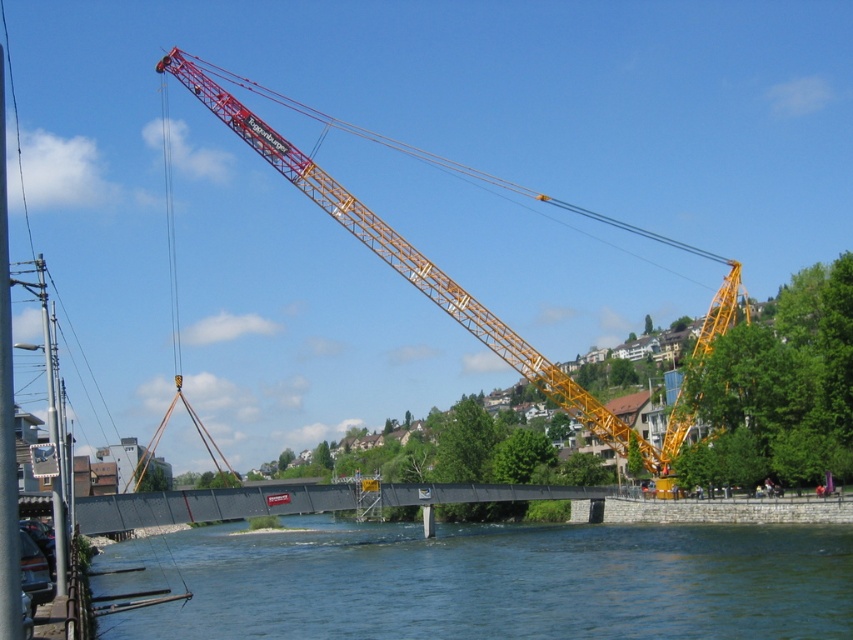
Question: Does clear blue water at lower center have a greater width compared to red/yellow metal crane at upper center?

Choices:
 (A) no
 (B) yes

Answer: (A)

Question: Can you confirm if clear blue water at lower center is positioned above red/yellow metal crane at upper center?

Choices:
 (A) no
 (B) yes

Answer: (A)

Question: Which object is closer to the camera taking this photo?

Choices:
 (A) red/yellow metal crane at upper center
 (B) clear blue water at lower center

Answer: (B)

Question: Observing the image, what is the correct spatial positioning of clear blue water at lower center in reference to red/yellow metal crane at upper center?

Choices:
 (A) below
 (B) above

Answer: (A)